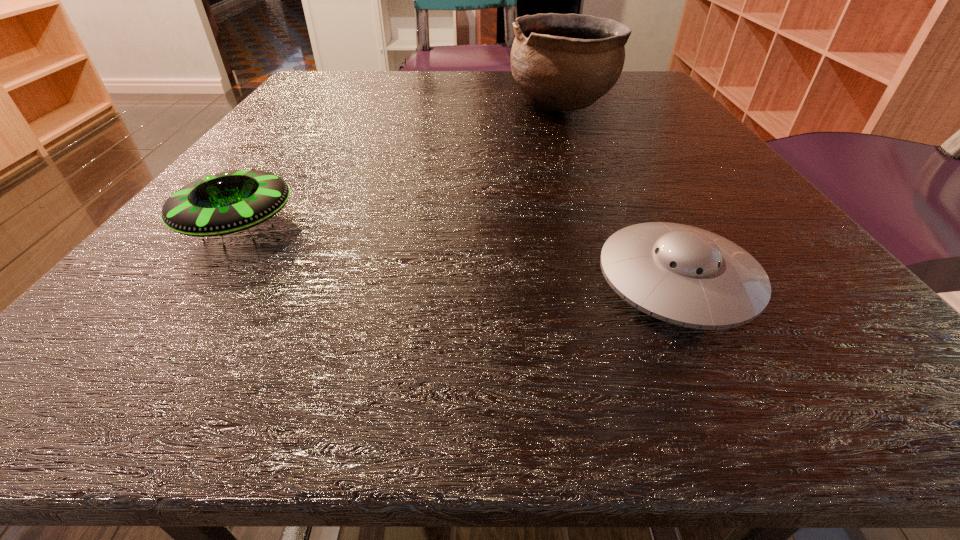
Locate an element on the screen. object that is at the near edge is located at coordinates (684, 275).

Where is `object situated at the left edge`? object situated at the left edge is located at coordinates (224, 201).

Find the location of a particular element. Image resolution: width=960 pixels, height=540 pixels. pottery present at the right edge is located at coordinates (562, 62).

This screenshot has width=960, height=540. What are the coordinates of `saucer that is at the right edge` in the screenshot? It's located at (684, 275).

This screenshot has height=540, width=960. In order to click on object that is positioned at the far right corner in this screenshot , I will do pos(562,62).

Where is `object located at the near right corner`? Image resolution: width=960 pixels, height=540 pixels. object located at the near right corner is located at coordinates point(684,275).

The image size is (960, 540). Find the location of `vacant space at the far edge of the desktop`. vacant space at the far edge of the desktop is located at coordinates (465, 99).

In the image, there is a desktop. Where is `vacant space at the near edge`? vacant space at the near edge is located at coordinates (324, 352).

Locate an element on the screen. vacant space at the left edge of the desktop is located at coordinates (268, 126).

You are a GUI agent. You are given a task and a screenshot of the screen. Output one action in this format:
    pyautogui.click(x=<x>, y=<y>)
    Task: Click on the free space at the right edge of the desktop
    The image size is (960, 540).
    Given the screenshot: What is the action you would take?
    pyautogui.click(x=760, y=236)